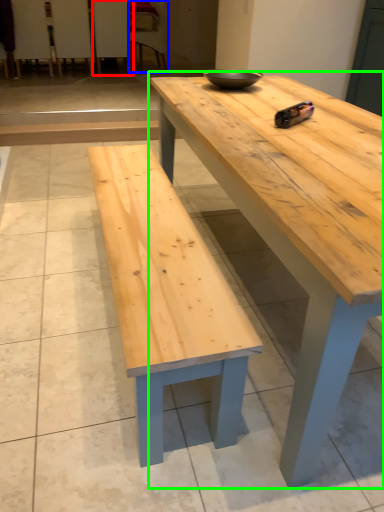
Question: Which is nearer to the chair (highlighted by a red box)? chair (highlighted by a blue box) or coffee table (highlighted by a green box).

Choices:
 (A) chair
 (B) coffee table

Answer: (A)